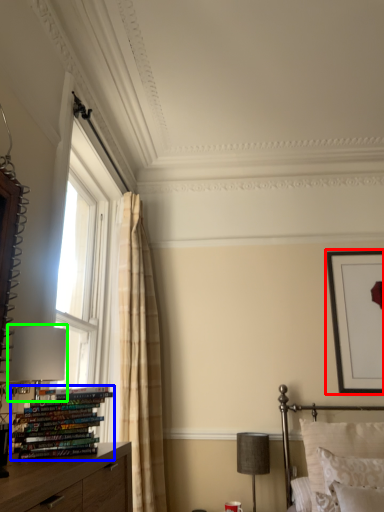
Question: Based on their relative distances, which object is nearer to picture frame (highlighted by a red box)? Choose from book (highlighted by a blue box) and table lamp (highlighted by a green box).

Choices:
 (A) book
 (B) table lamp

Answer: (B)